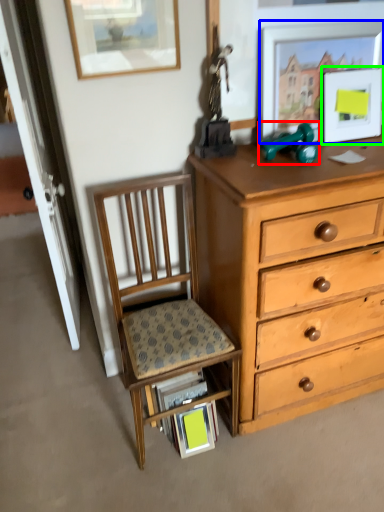
Question: Based on their relative distances, which object is nearer to toy (highlighted by a red box)? Choose from picture frame (highlighted by a blue box) and picture frame (highlighted by a green box).

Choices:
 (A) picture frame
 (B) picture frame

Answer: (A)